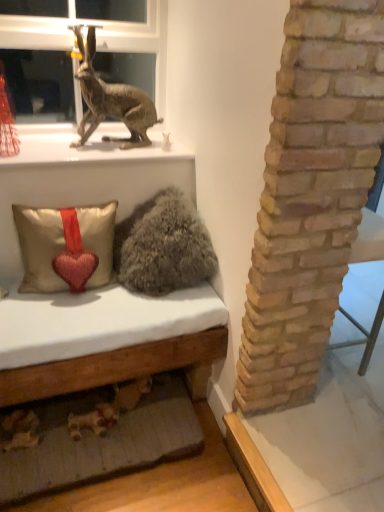
The width and height of the screenshot is (384, 512). In order to click on free space in front of fuzzy gray pillow at center in this screenshot , I will do `click(144, 318)`.